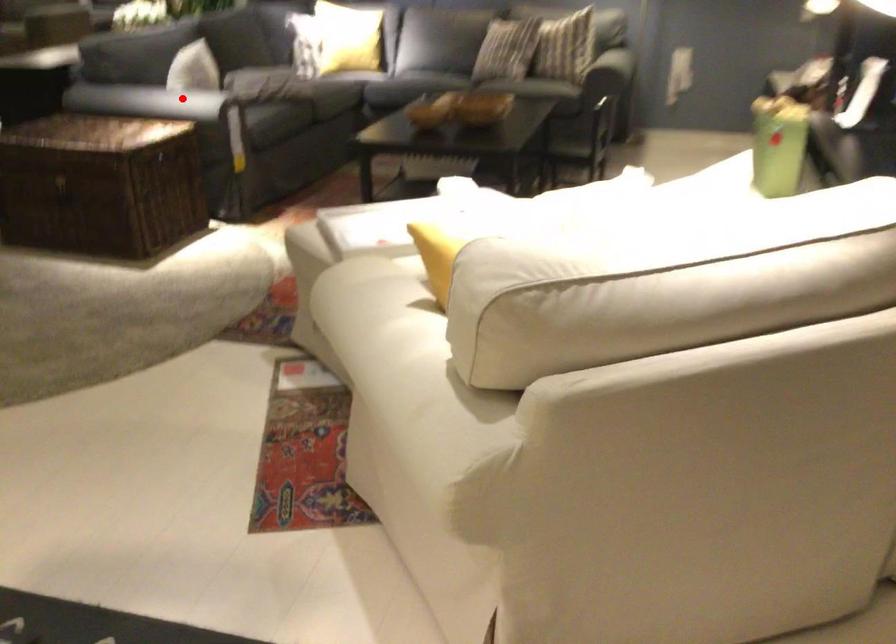
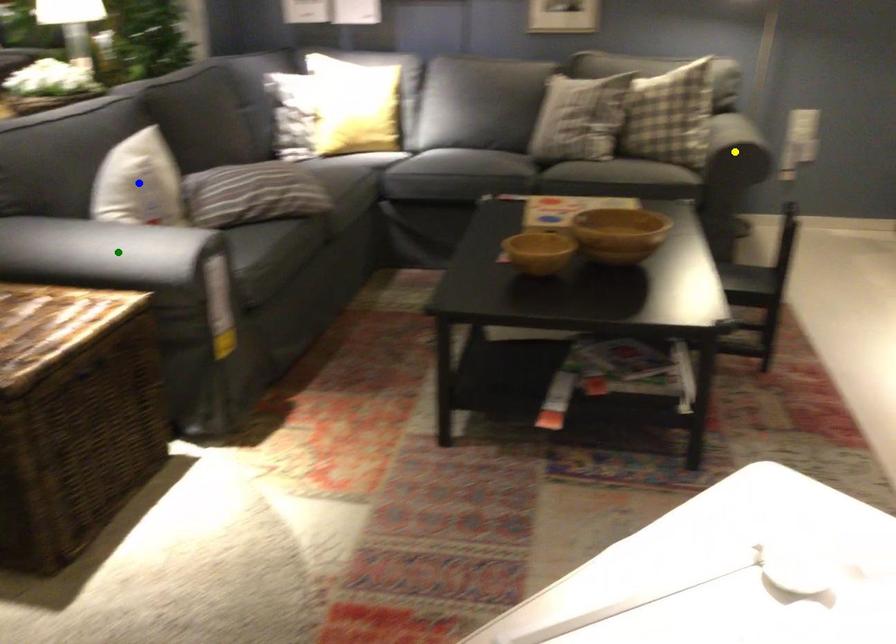
Question: I am providing you with two images of the same scene from different viewpoints. A red point is marked on the first image. You are given multiple points on the second image. Which mark in image 2 goes with the point in image 1?

Choices:
 (A) yellow point
 (B) green point
 (C) blue point

Answer: (B)